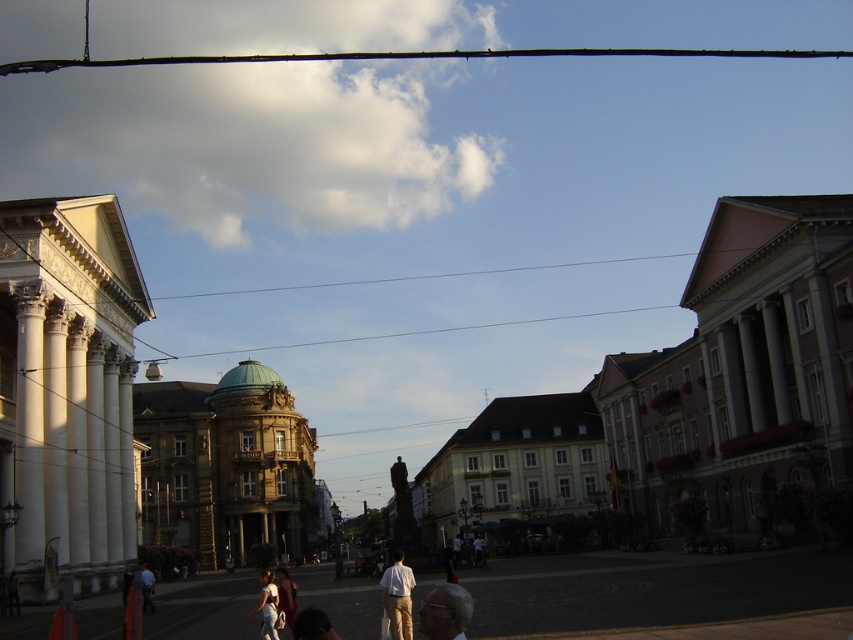
Question: Which point is closer to the camera taking this photo?

Choices:
 (A) (285, 608)
 (B) (189, 481)
 (C) (125, 570)
 (D) (296, 621)

Answer: (D)

Question: Which point is farther to the camera?

Choices:
 (A) dark hair at lower center
 (B) dark blue jeans at lower center

Answer: (B)

Question: Is dark hair at lower center bigger than light brown leather jacket at lower center?

Choices:
 (A) no
 (B) yes

Answer: (A)

Question: Based on their relative distances, which object is farther from the dark hair at lower center?

Choices:
 (A) dark blue jeans at lower center
 (B) gray fabric head at lower center

Answer: (A)

Question: Where is white stone building at center located in relation to white matte shirt at center in the image?

Choices:
 (A) left
 (B) right

Answer: (A)

Question: Can you confirm if white matte shirt at center is positioned below dark blue jeans at lower center?

Choices:
 (A) yes
 (B) no

Answer: (B)